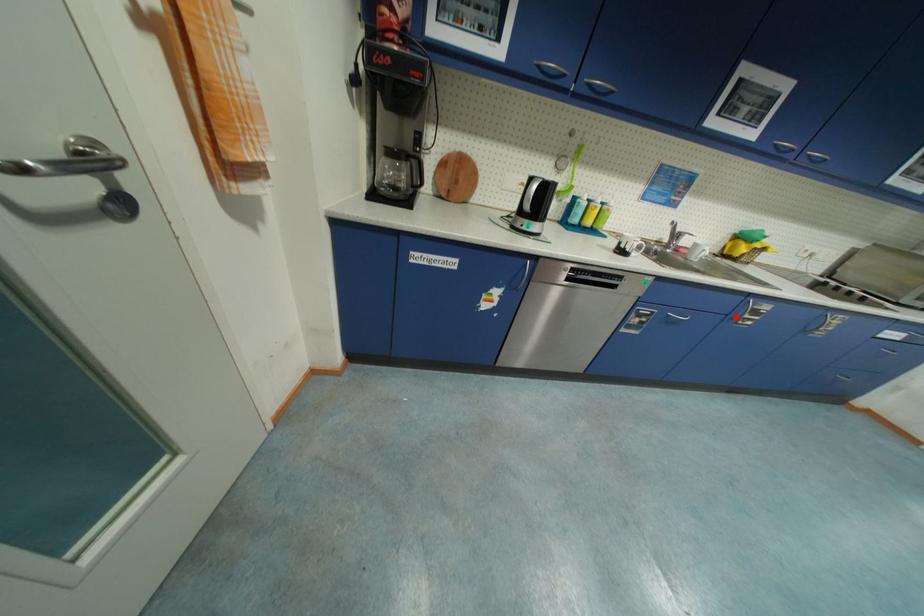
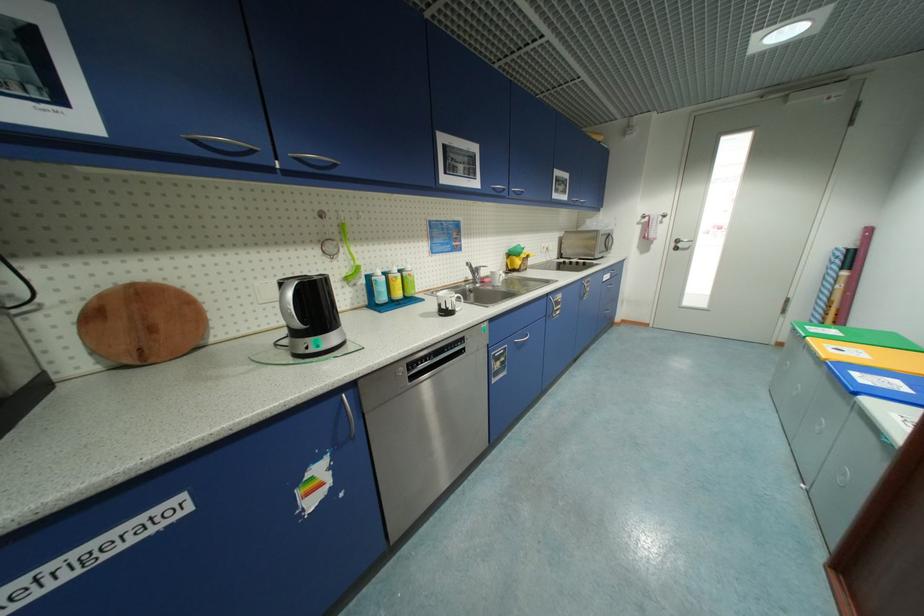
The point at the highlighted location is marked in the first image. Where is the corresponding point in the second image?

(553, 315)